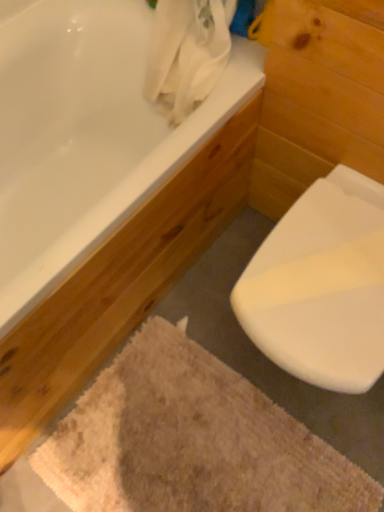
Question: Is the position of white glossy bathtub at upper left less distant than that of beige textured bath mat at lower center?

Choices:
 (A) no
 (B) yes

Answer: (B)

Question: Is white glossy bathtub at upper left next to beige textured bath mat at lower center and touching it?

Choices:
 (A) yes
 (B) no

Answer: (B)

Question: Can you confirm if white glossy bathtub at upper left is taller than beige textured bath mat at lower center?

Choices:
 (A) no
 (B) yes

Answer: (B)

Question: Does white glossy bathtub at upper left lie behind beige textured bath mat at lower center?

Choices:
 (A) yes
 (B) no

Answer: (B)

Question: Does white glossy bathtub at upper left appear on the right side of beige textured bath mat at lower center?

Choices:
 (A) yes
 (B) no

Answer: (B)

Question: In the image, is beige textured bath mat at lower center on the left side or the right side of white glossy bathtub at upper left?

Choices:
 (A) left
 (B) right

Answer: (B)

Question: From the image's perspective, is beige textured bath mat at lower center positioned above or below white glossy bathtub at upper left?

Choices:
 (A) below
 (B) above

Answer: (A)

Question: From a real-world perspective, is beige textured bath mat at lower center positioned above or below white glossy bathtub at upper left?

Choices:
 (A) below
 (B) above

Answer: (A)

Question: Is point (119, 503) positioned closer to the camera than point (208, 137)?

Choices:
 (A) farther
 (B) closer

Answer: (A)

Question: In the image, is white glossy toilet at lower right on the left side or the right side of beige textured bath mat at lower center?

Choices:
 (A) left
 (B) right

Answer: (B)

Question: From a real-world perspective, is white glossy toilet at lower right physically located above or below beige textured bath mat at lower center?

Choices:
 (A) below
 (B) above

Answer: (B)

Question: Based on their sizes in the image, would you say white glossy toilet at lower right is bigger or smaller than beige textured bath mat at lower center?

Choices:
 (A) small
 (B) big

Answer: (B)

Question: Choose the correct answer: Is white glossy toilet at lower right inside beige textured bath mat at lower center or outside it?

Choices:
 (A) outside
 (B) inside

Answer: (A)

Question: Is white glossy bathtub at upper left situated inside beige textured bath mat at lower center or outside?

Choices:
 (A) outside
 (B) inside

Answer: (A)

Question: Based on their sizes in the image, would you say white glossy bathtub at upper left is bigger or smaller than beige textured bath mat at lower center?

Choices:
 (A) big
 (B) small

Answer: (A)